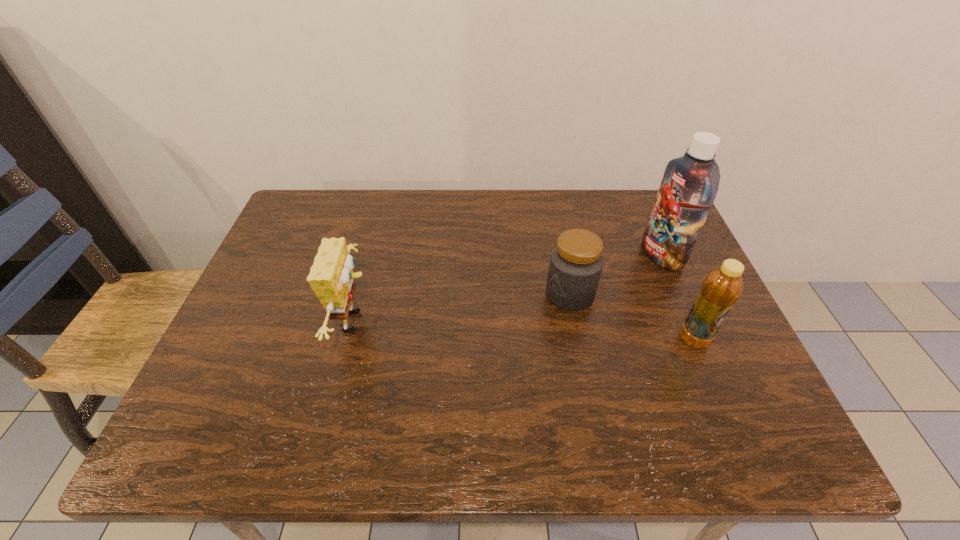
Where is `free space located 0.380m on the front label of the shampoo`? This screenshot has height=540, width=960. free space located 0.380m on the front label of the shampoo is located at coordinates (529, 312).

You are a GUI agent. You are given a task and a screenshot of the screen. Output one action in this format:
    pyautogui.click(x=<x>, y=<y>)
    Task: Click on the vacant area located 0.100m on the surface of the third object from right to left near the warning symbol
    This screenshot has height=540, width=960.
    Given the screenshot: What is the action you would take?
    pyautogui.click(x=516, y=318)

The height and width of the screenshot is (540, 960). I want to click on vacant space located 0.350m on the surface of the third object from right to left near the warning symbol, so click(420, 360).

This screenshot has height=540, width=960. In order to click on free point located on the surface of the third object from right to left near the warning symbol in this screenshot , I will do `click(420, 360)`.

Image resolution: width=960 pixels, height=540 pixels. Find the location of `object situated at the near edge`. object situated at the near edge is located at coordinates (331, 277).

You are a GUI agent. You are given a task and a screenshot of the screen. Output one action in this format:
    pyautogui.click(x=<x>, y=<y>)
    Task: Click on the bottle that is at the right edge
    This screenshot has width=960, height=540.
    Given the screenshot: What is the action you would take?
    pyautogui.click(x=722, y=287)

Where is `shampoo at the right edge`? The width and height of the screenshot is (960, 540). shampoo at the right edge is located at coordinates (690, 183).

I want to click on vacant space at the far edge of the desktop, so click(x=431, y=214).

Where is `vacant space at the near edge of the desktop`? vacant space at the near edge of the desktop is located at coordinates (446, 389).

Identify the location of vacant space at the left edge of the desktop. The height and width of the screenshot is (540, 960). tap(297, 240).